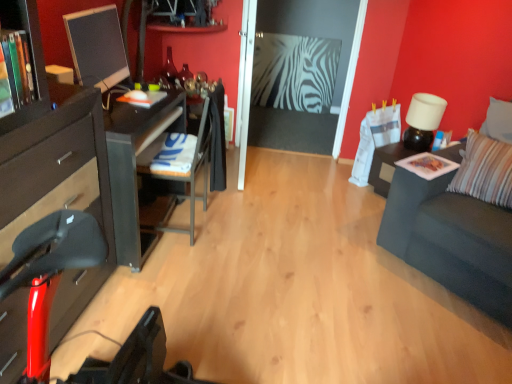
Question: Is dark gray fabric couch at right further to the viewer compared to metallic silver shelf at upper center?

Choices:
 (A) no
 (B) yes

Answer: (A)

Question: From a real-world perspective, is dark gray fabric couch at right below metallic silver shelf at upper center?

Choices:
 (A) no
 (B) yes

Answer: (B)

Question: Is dark gray fabric couch at right located outside metallic silver shelf at upper center?

Choices:
 (A) no
 (B) yes

Answer: (B)

Question: Can you confirm if dark gray fabric couch at right is smaller than metallic silver shelf at upper center?

Choices:
 (A) no
 (B) yes

Answer: (A)

Question: Is metallic silver shelf at upper center a part of dark gray fabric couch at right?

Choices:
 (A) yes
 (B) no

Answer: (B)

Question: Is the position of dark gray fabric couch at right less distant than that of metallic silver shelf at upper center?

Choices:
 (A) no
 (B) yes

Answer: (B)

Question: Does metallic silver shelf at upper center have a lesser width compared to wooden bookshelf at left?

Choices:
 (A) no
 (B) yes

Answer: (A)

Question: Is metallic silver shelf at upper center at the right side of wooden bookshelf at left?

Choices:
 (A) no
 (B) yes

Answer: (B)

Question: Does metallic silver shelf at upper center appear on the left side of wooden bookshelf at left?

Choices:
 (A) yes
 (B) no

Answer: (B)

Question: Is wooden bookshelf at left a part of metallic silver shelf at upper center?

Choices:
 (A) no
 (B) yes

Answer: (A)

Question: Is metallic silver shelf at upper center located outside wooden bookshelf at left?

Choices:
 (A) no
 (B) yes

Answer: (B)

Question: Is metallic silver shelf at upper center positioned far away from wooden bookshelf at left?

Choices:
 (A) yes
 (B) no

Answer: (A)

Question: From a real-world perspective, does white matte lamp at upper right sit lower than wooden bookshelf at left?

Choices:
 (A) yes
 (B) no

Answer: (A)